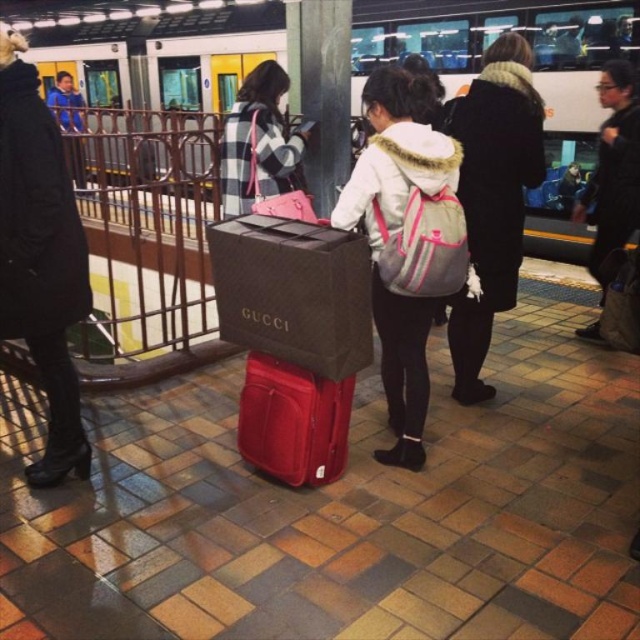
Is white fleece jacket at center to the left of matte red suitcase at center from the viewer's perspective?

No, white fleece jacket at center is not to the left of matte red suitcase at center.

How far apart are white fleece jacket at center and matte red suitcase at center?

They are 21.64 inches apart.

Find the location of `white fleece jacket at center`. white fleece jacket at center is located at coordinates (396, 234).

Between white fleece jacket at center and plaid fabric jacket at upper center, which one is positioned higher?

plaid fabric jacket at upper center

Who is more distant from viewer, (356, 193) or (296, 170)?

The point (296, 170) is more distant.

I want to click on white fleece jacket at center, so click(x=396, y=234).

Is smooth gray pillar at center positioned behind black leather jacket at upper right?

Yes, smooth gray pillar at center is further from the viewer.

Find the location of `smooth gray pillar at center`. smooth gray pillar at center is located at coordinates (321, 90).